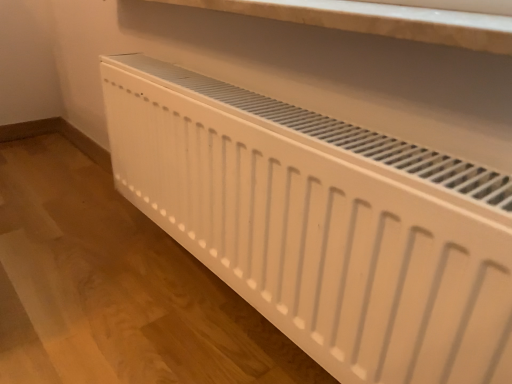
What do you see at coordinates (323, 224) in the screenshot? I see `white matte radiator at lower center` at bounding box center [323, 224].

What is the approximate width of white matte radiator at lower center?

The width of white matte radiator at lower center is 5.29 inches.

Image resolution: width=512 pixels, height=384 pixels. Find the location of `white matte radiator at lower center`. white matte radiator at lower center is located at coordinates (323, 224).

The height and width of the screenshot is (384, 512). Identify the location of white marble shelf at upper center. (378, 20).

What is the approximate height of white marble shelf at upper center?

The height of white marble shelf at upper center is 0.93 inches.

Describe the element at coordinates (378, 20) in the screenshot. The height and width of the screenshot is (384, 512). I see `white marble shelf at upper center` at that location.

Find the location of a particular element. The height and width of the screenshot is (384, 512). white matte radiator at lower center is located at coordinates (323, 224).

Which is more to the left, white matte radiator at lower center or white marble shelf at upper center?

Positioned to the left is white matte radiator at lower center.

Considering their positions, is white matte radiator at lower center located in front of or behind white marble shelf at upper center?

white matte radiator at lower center is in front of white marble shelf at upper center.

Between point (269, 124) and point (469, 25), which one is positioned in front?

The point (469, 25) is more forward.

From the image's perspective, relative to white marble shelf at upper center, is white matte radiator at lower center above or below?

white matte radiator at lower center is below white marble shelf at upper center.

From a real-world perspective, is white matte radiator at lower center positioned under white marble shelf at upper center based on gravity?

Yes, from a real-world perspective, white matte radiator at lower center is below white marble shelf at upper center.

Does white matte radiator at lower center have a greater width compared to white marble shelf at upper center?

In fact, white matte radiator at lower center might be narrower than white marble shelf at upper center.

Considering the relative sizes of white matte radiator at lower center and white marble shelf at upper center in the image provided, is white matte radiator at lower center taller than white marble shelf at upper center?

Indeed, white matte radiator at lower center has a greater height compared to white marble shelf at upper center.

Considering the sizes of objects white matte radiator at lower center and white marble shelf at upper center in the image provided, who is bigger, white matte radiator at lower center or white marble shelf at upper center?

Bigger between the two is white matte radiator at lower center.

Can white marble shelf at upper center be found inside white matte radiator at lower center?

No, white marble shelf at upper center is not inside white matte radiator at lower center.

Is white matte radiator at lower center positioned far away from white marble shelf at upper center?

white matte radiator at lower center is near white marble shelf at upper center, not far away.

Is white matte radiator at lower center positioned with its back to white marble shelf at upper center?

No, white matte radiator at lower center is not facing the opposite direction of white marble shelf at upper center.

Identify the location of shelf behind the white matte radiator at lower center. (378, 20).

Considering the relative positions of white marble shelf at upper center and white matte radiator at lower center in the image provided, is white marble shelf at upper center to the left or to the right of white matte radiator at lower center?

Based on their positions, white marble shelf at upper center is located to the right of white matte radiator at lower center.

Which is behind, white marble shelf at upper center or white matte radiator at lower center?

white marble shelf at upper center is more distant.

Does point (454, 34) come in front of point (146, 150)?

Yes, it is.

From the image's perspective, who appears lower, white marble shelf at upper center or white matte radiator at lower center?

From the image's view, white matte radiator at lower center is below.

From a real-world perspective, which object stands above the other?

white marble shelf at upper center is physically above.

Which of these two, white marble shelf at upper center or white matte radiator at lower center, is thinner?

With smaller width is white matte radiator at lower center.

In terms of height, does white marble shelf at upper center look taller or shorter compared to white matte radiator at lower center?

white marble shelf at upper center is shorter than white matte radiator at lower center.

Considering the relative sizes of white marble shelf at upper center and white matte radiator at lower center in the image provided, is white marble shelf at upper center bigger than white matte radiator at lower center?

No.

Would you say white marble shelf at upper center contains white matte radiator at lower center?

No, white matte radiator at lower center is not surrounded by white marble shelf at upper center.

Are white marble shelf at upper center and white matte radiator at lower center far apart?

No, there isn't a large distance between white marble shelf at upper center and white matte radiator at lower center.

Could you tell me if white marble shelf at upper center is facing white matte radiator at lower center?

No.

Locate an element on the screen. home appliance located below the white marble shelf at upper center (from the image's perspective) is located at coordinates (323, 224).

I want to click on home appliance lying below the white marble shelf at upper center (from the image's perspective), so click(323, 224).

The height and width of the screenshot is (384, 512). In order to click on home appliance to the left of white marble shelf at upper center in this screenshot , I will do `click(323, 224)`.